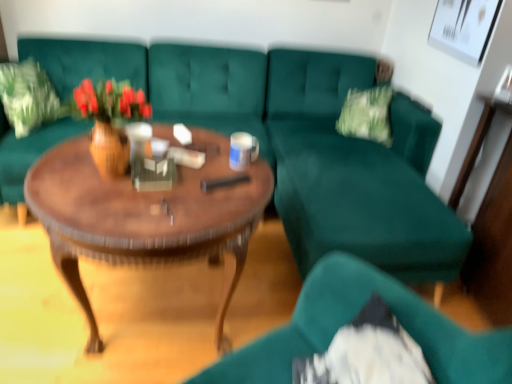
Identify the location of vacant region to the left of wooden vase with flowers at center. (58, 167).